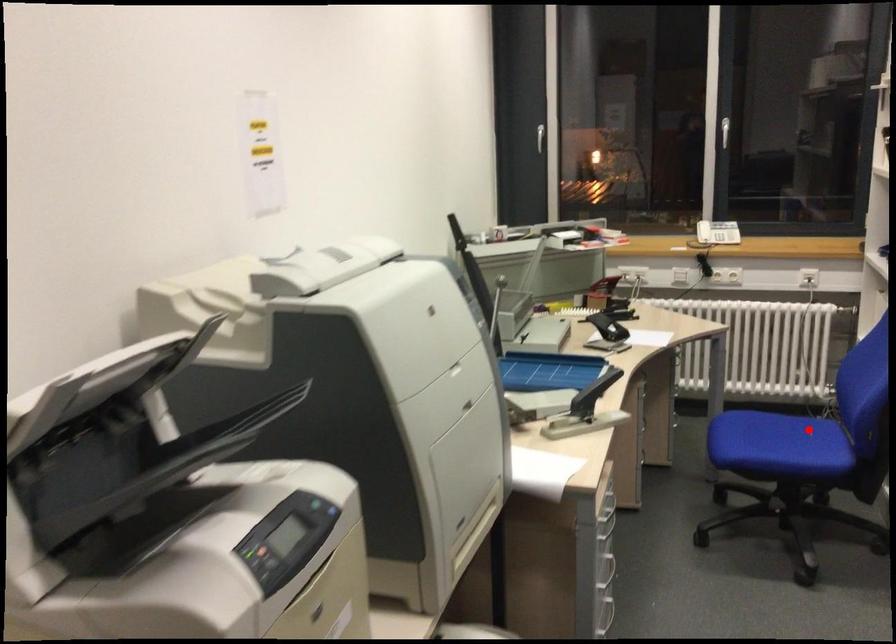
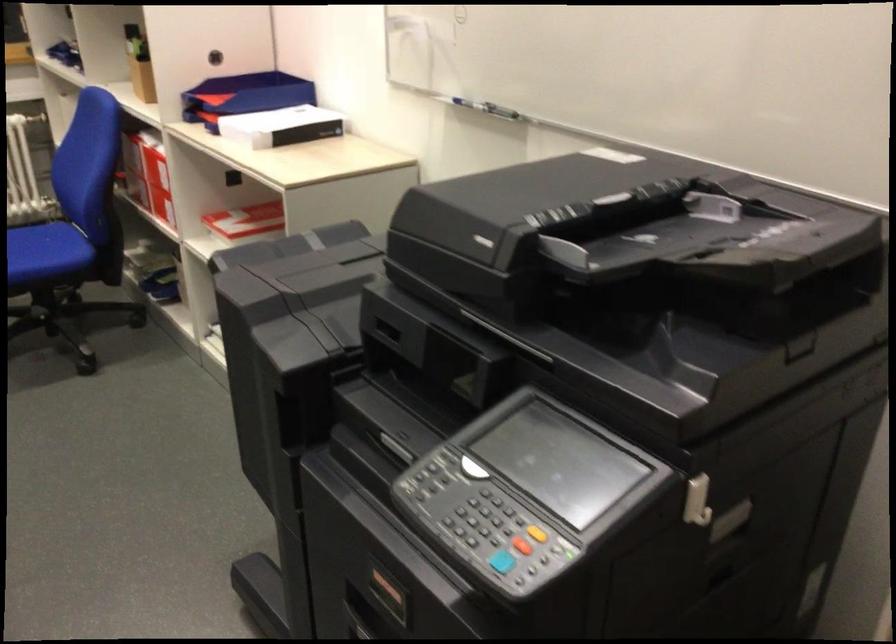
Locate, in the second image, the point that corresponds to the highlighted location in the first image.

(42, 243)